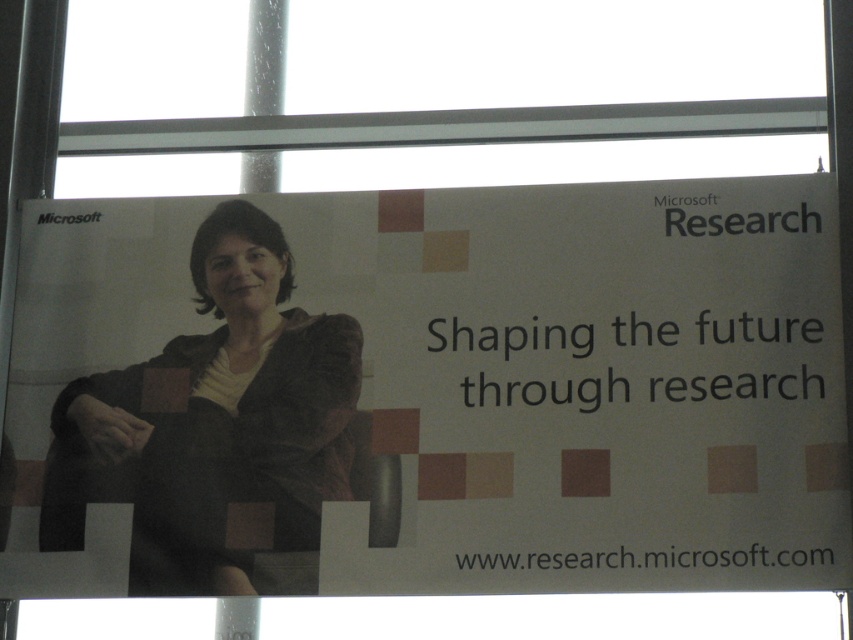
Question: Among these objects, which one is farthest from the camera?

Choices:
 (A) matte brown jacket at center
 (B) white paper at center

Answer: (A)

Question: Among these objects, which one is farthest from the camera?

Choices:
 (A) matte brown jacket at center
 (B) white paper at center

Answer: (A)

Question: Is white paper at center bigger than matte brown jacket at center?

Choices:
 (A) no
 (B) yes

Answer: (B)

Question: Can you confirm if white paper at center is wider than matte brown jacket at center?

Choices:
 (A) yes
 (B) no

Answer: (A)

Question: Which point appears closest to the camera in this image?

Choices:
 (A) (254, 289)
 (B) (447, 278)

Answer: (B)

Question: Is white paper at center to the left of matte brown jacket at center from the viewer's perspective?

Choices:
 (A) no
 (B) yes

Answer: (A)